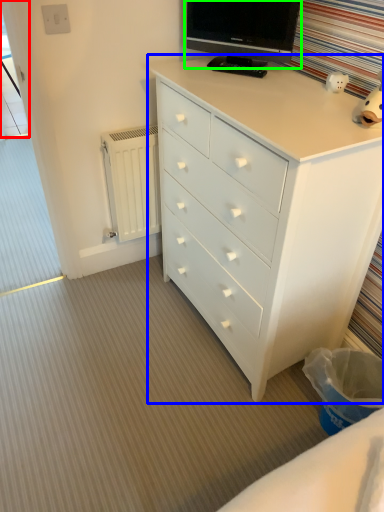
Question: Considering the real-world distances, which object is farthest from screen door (highlighted by a red box)? chest of drawers (highlighted by a blue box) or television (highlighted by a green box)?

Choices:
 (A) chest of drawers
 (B) television

Answer: (A)